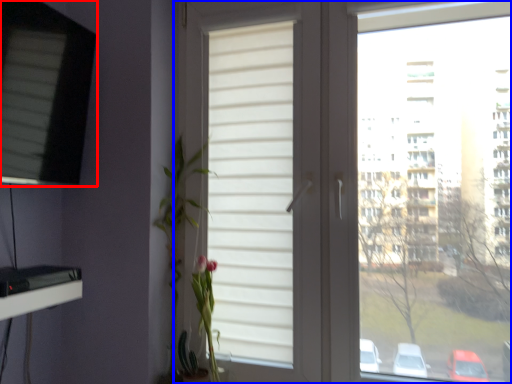
Question: Which point is closer to the camera, window (highlighted by a red box) or window (highlighted by a blue box)?

Choices:
 (A) window
 (B) window

Answer: (B)